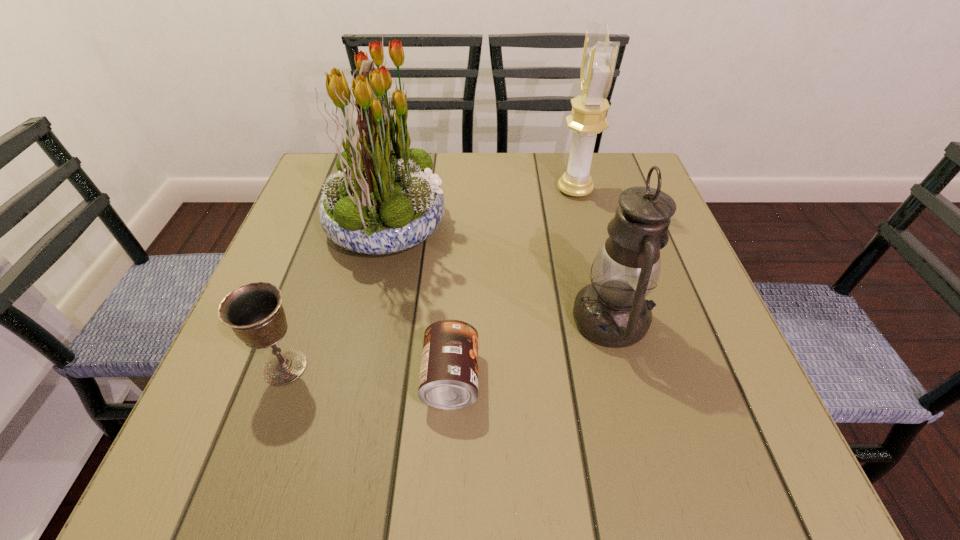
Where is `free space at the far edge of the desktop`? This screenshot has height=540, width=960. free space at the far edge of the desktop is located at coordinates (515, 154).

This screenshot has width=960, height=540. I want to click on vacant area at the near edge of the desktop, so click(x=551, y=463).

The width and height of the screenshot is (960, 540). I want to click on vacant space at the right edge of the desktop, so click(x=660, y=278).

The height and width of the screenshot is (540, 960). I want to click on vacant space at the far left corner, so click(303, 200).

This screenshot has width=960, height=540. In the image, there is a desktop. What are the coordinates of `vacant space at the near left corner` in the screenshot? It's located at (195, 438).

In the image, there is a desktop. Where is `vacant area at the far right corner`? This screenshot has width=960, height=540. vacant area at the far right corner is located at coordinates (592, 166).

Locate an element on the screen. The width and height of the screenshot is (960, 540). vacant space that is in between the flower arrangement and the shortest object is located at coordinates (420, 302).

The width and height of the screenshot is (960, 540). In order to click on vacant area between the award and the can in this screenshot , I will do `click(513, 285)`.

Where is `free space between the shortest object and the oil lamp`? Image resolution: width=960 pixels, height=540 pixels. free space between the shortest object and the oil lamp is located at coordinates (531, 349).

I want to click on blank region between the oil lamp and the flower arrangement, so click(x=499, y=272).